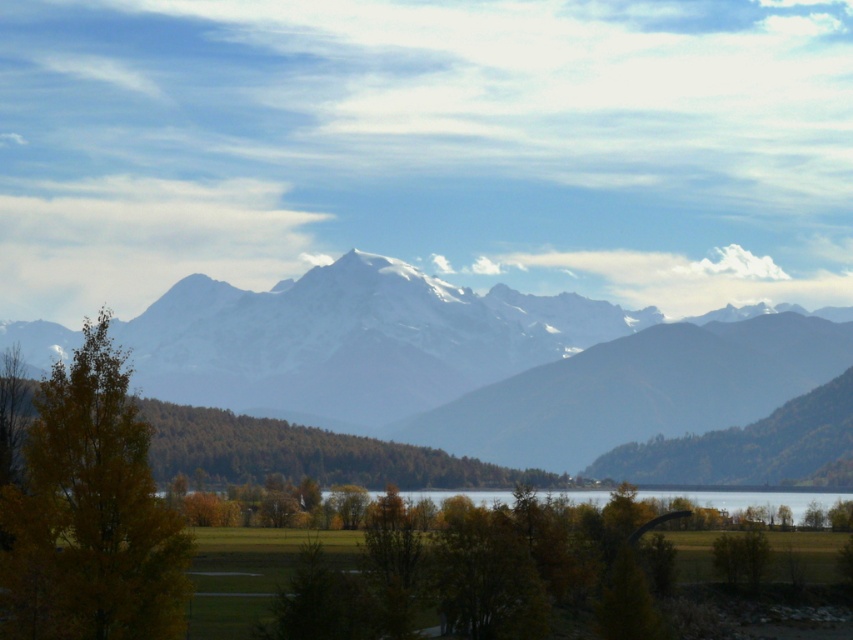
Is brown matte tree at lower left smaller than transparent water at center?

Correct, brown matte tree at lower left occupies less space than transparent water at center.

Is brown matte tree at lower left in front of transparent water at center?

No, brown matte tree at lower left is further to the viewer.

Is point (172, 444) positioned in front of point (801, 509)?

That is True.

At what (x,y) coordinates should I click in order to perform the action: click on brown matte tree at lower left. Please return your answer as a coordinate pair (x, y). The height and width of the screenshot is (640, 853). Looking at the image, I should click on (305, 452).

Between white snow-covered mountain range at center and yellow-green foliage at left, which one has more height?

white snow-covered mountain range at center is taller.

Identify the location of white snow-covered mountain range at center. Image resolution: width=853 pixels, height=640 pixels. (416, 356).

Find the location of a particular element. Image resolution: width=853 pixels, height=640 pixels. white snow-covered mountain range at center is located at coordinates (416, 356).

Which is more to the right, yellow-green foliage at left or brown matte tree at lower left?

yellow-green foliage at left

Between point (49, 573) and point (538, 472), which one is positioned behind?

The point (538, 472) is behind.

Between point (141, 472) and point (454, 483), which one is positioned behind?

The point (454, 483) is behind.

Find the location of a particular element. The width and height of the screenshot is (853, 640). yellow-green foliage at left is located at coordinates (90, 513).